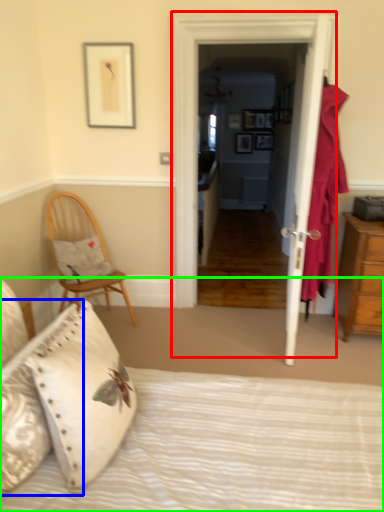
Question: Which is nearer to the door (highlighted by a red box)? pillow (highlighted by a blue box) or bed (highlighted by a green box).

Choices:
 (A) pillow
 (B) bed

Answer: (B)